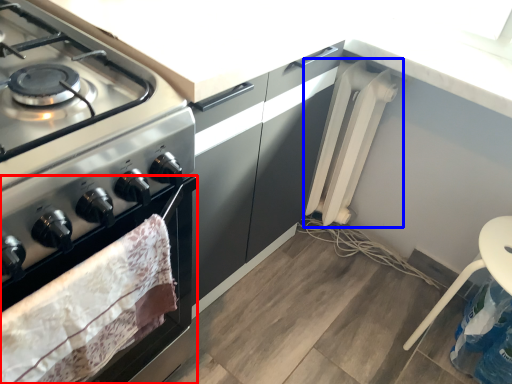
Question: Which point is closer to the camera, oven (highlighted by a red box) or appliance (highlighted by a blue box)?

Choices:
 (A) oven
 (B) appliance

Answer: (A)